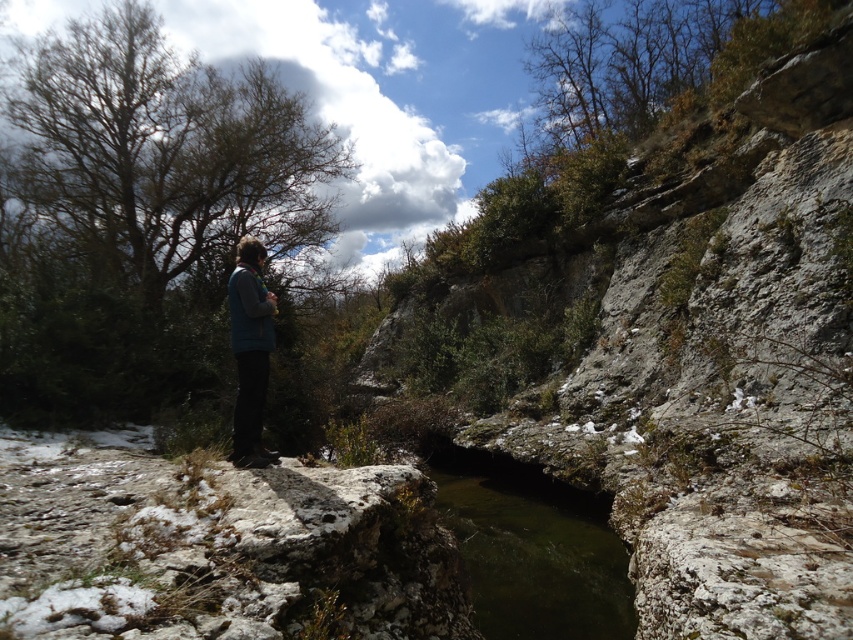
Question: Which point is closer to the camera?

Choices:
 (A) (248, 339)
 (B) (25, 627)
 (C) (561, 522)

Answer: (B)

Question: Which point appears farthest from the camera in this image?

Choices:
 (A) (154, 561)
 (B) (378, 348)

Answer: (B)

Question: Based on their relative distances, which object is farther from the greenish rock at center?

Choices:
 (A) rough stone hillside at center
 (B) snowy rock at lower left
 (C) blue fleece jacket at center

Answer: (C)

Question: Does rough stone hillside at center have a larger size compared to snowy rock at lower left?

Choices:
 (A) yes
 (B) no

Answer: (A)

Question: Does rough stone hillside at center have a larger size compared to snowy rock at lower left?

Choices:
 (A) yes
 (B) no

Answer: (A)

Question: Is snowy rock at lower left wider than greenish rock at center?

Choices:
 (A) yes
 (B) no

Answer: (A)